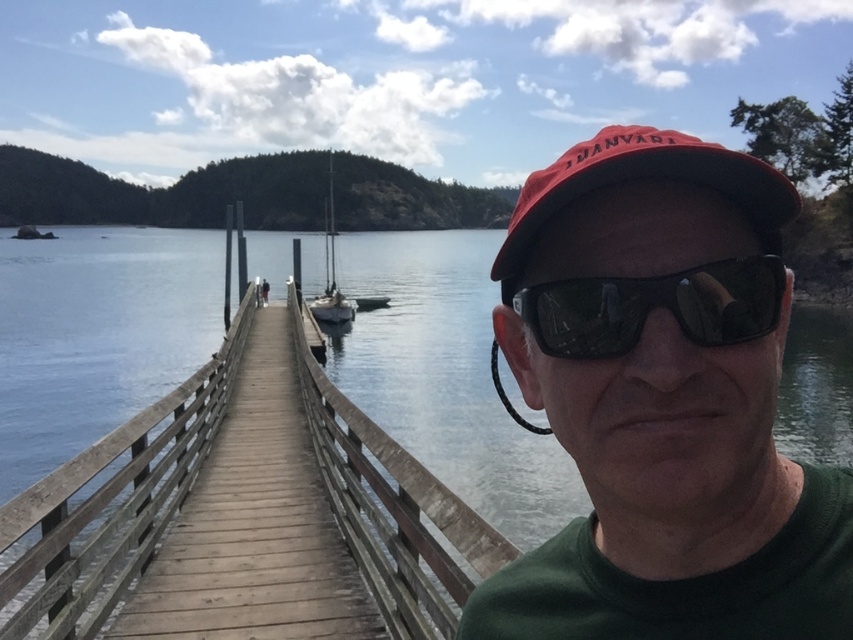
You are a photographer trying to capture the matte red cap at center in your shot. Based on the scene, where should you position your camera to ensure the cap is centered in the frame?

The matte red cap at center is already positioned at the center of the frame at coordinates point (663, 403), so positioning the camera to aim directly at this point will keep it centered.